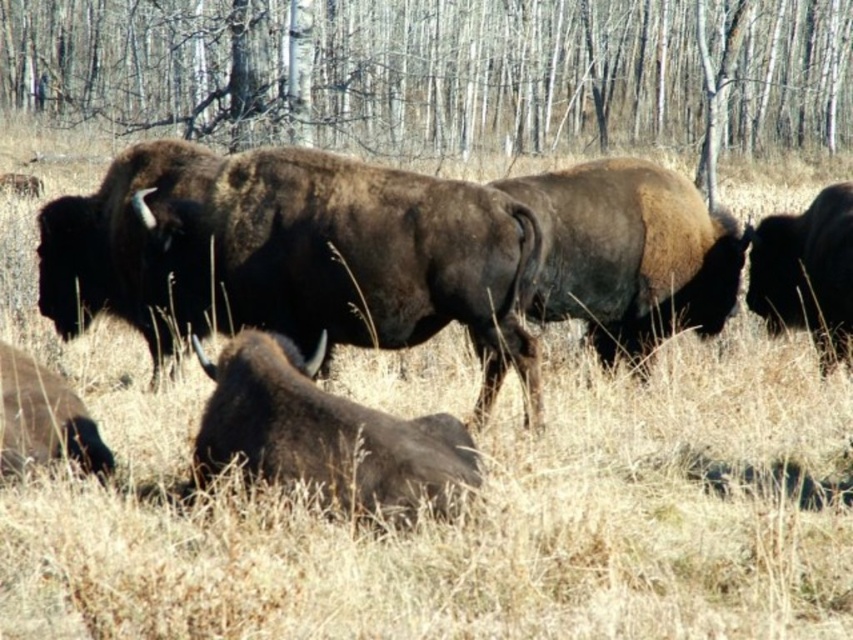
Between point (746, 104) and point (73, 435), which one is positioned in front?

Point (73, 435)

You are a GUI agent. You are given a task and a screenshot of the screen. Output one action in this format:
    pyautogui.click(x=<x>, y=<y>)
    Task: Click on the bare wood trees at upper center
    
    Given the screenshot: What is the action you would take?
    pyautogui.click(x=444, y=70)

Locate an element on the screen. This screenshot has height=640, width=853. bare wood trees at upper center is located at coordinates (444, 70).

Who is positioned more to the left, bare wood trees at upper center or brown fuzzy bison at center?

Positioned to the left is bare wood trees at upper center.

In order to click on bare wood trees at upper center in this screenshot , I will do `click(444, 70)`.

Identify the location of bare wood trees at upper center. The image size is (853, 640). (444, 70).

Who is shorter, brown rough fur at center or black fur at right?

With less height is black fur at right.

Who is more forward, (234, 180) or (850, 209)?

Point (234, 180) is more forward.

I want to click on brown rough fur at center, so click(293, 253).